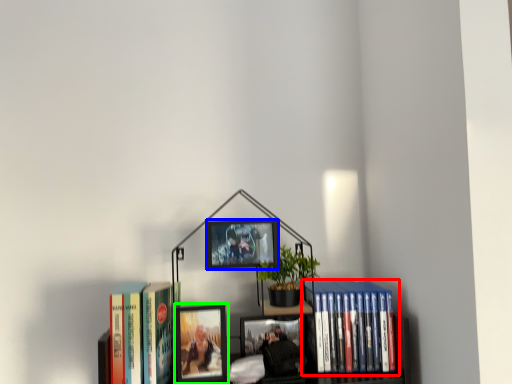
Question: Which object is the closest to the book (highlighted by a red box)? Choose among these: picture frame (highlighted by a blue box) or picture frame (highlighted by a green box).

Choices:
 (A) picture frame
 (B) picture frame

Answer: (A)